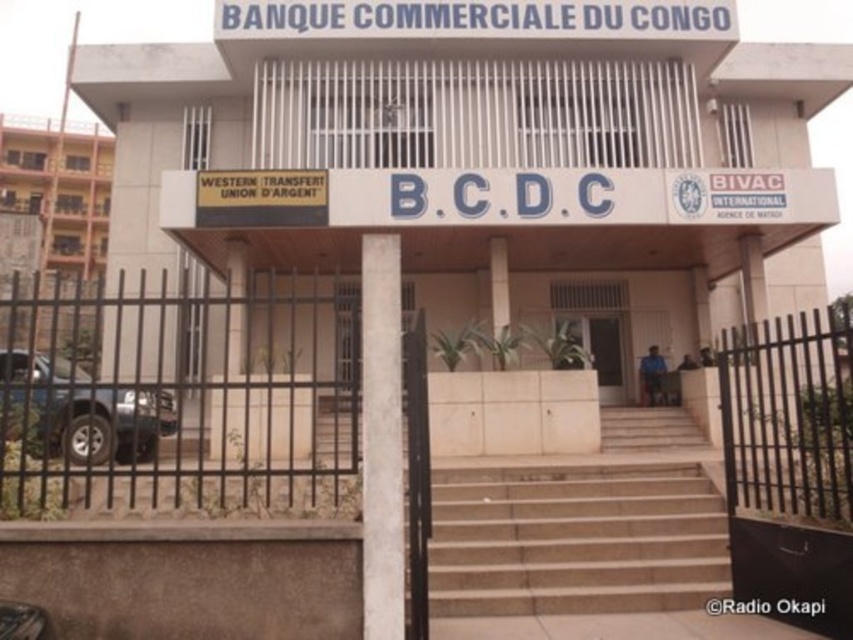
What is the spatial relationship between the beige concrete stairs at center and the white concrete pole at center in the image of the Banque Commerciale du Congo?

The beige concrete stairs at center is positioned on the right side of the white concrete pole at center.

You are standing in front of the Banque Commerciale du Congo and want to take a photo of the building. You notice two points on the building facade marked as point 1 at coordinates (527,484) and point 2 at coordinates (397,579). Which point will appear closer to the edge of your camera frame?

Point 2 at coordinates (397,579) will appear closer to the edge of your camera frame because it is closer to the camera than point 1 at coordinates (527,484).

You are a delivery driver approaching the Banque Commerciale du Congo. You need to park your blue metallic car at lower left next to the white concrete pole at center. Will the pole block the car from fully parking there?

The white concrete pole at center has a lesser width compared to the blue metallic car at lower left, so the pole is narrower than the car. However, the pole might still block part of the parking space depending on its position. Check the exact placement before parking.